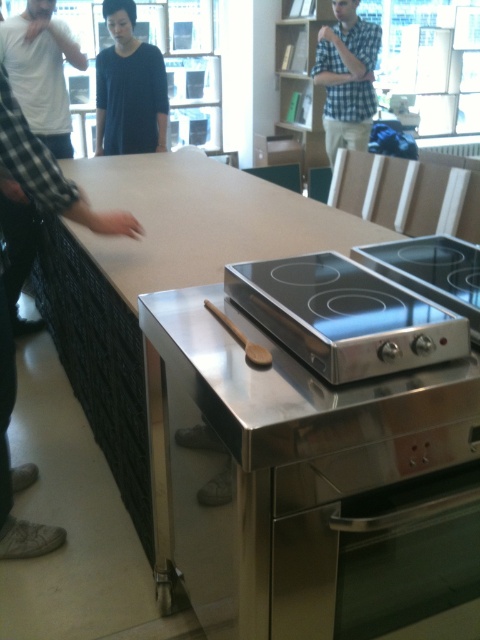
Question: Estimate the real-world distances between objects in this image. Which object is closer to the checkered fabric shirt at upper center?

Choices:
 (A) stainless steel cooktop at lower right
 (B) wooden bookshelf at upper center
 (C) white matte countertop at center

Answer: (B)

Question: Which of the following is the farthest from the observer?

Choices:
 (A) (285, 4)
 (B) (408, 292)
 (C) (165, 77)

Answer: (A)

Question: Observing the image, what is the correct spatial positioning of checkered fabric shirt at upper center in reference to stainless steel cooktop at center?

Choices:
 (A) left
 (B) right

Answer: (B)

Question: Which point is farther from the camera taking this photo?

Choices:
 (A) (323, 444)
 (B) (417, 292)
 (C) (312, 124)

Answer: (C)

Question: Is white matte countertop at center further to camera compared to stainless steel cooktop at center?

Choices:
 (A) no
 (B) yes

Answer: (A)

Question: Does stainless steel cooktop at lower right have a lesser width compared to wooden bookshelf at upper center?

Choices:
 (A) yes
 (B) no

Answer: (A)